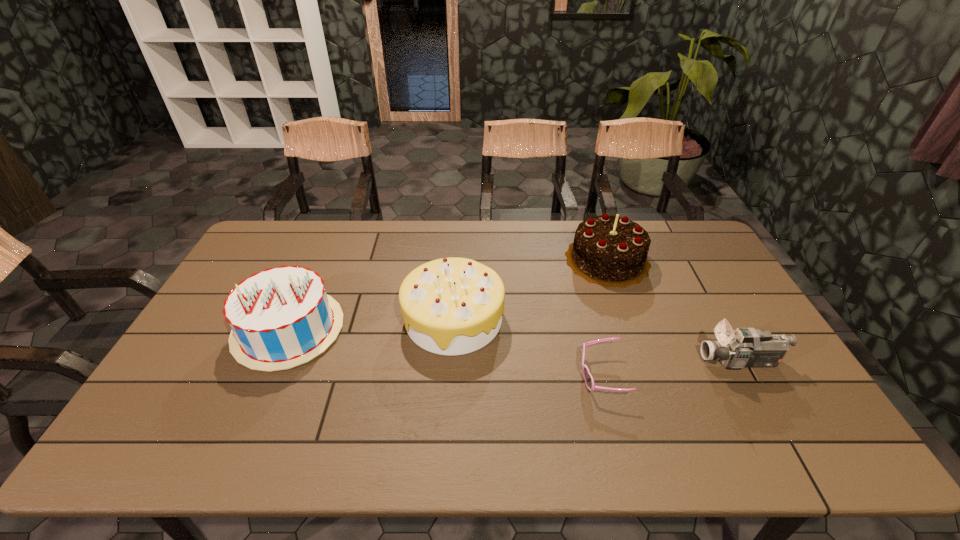
This screenshot has height=540, width=960. In order to click on the rightmost birthday cake in this screenshot , I will do `click(608, 250)`.

Where is `the leftmost object`? This screenshot has height=540, width=960. the leftmost object is located at coordinates (281, 317).

Where is `the second object from left to right`? This screenshot has width=960, height=540. the second object from left to right is located at coordinates (451, 306).

The height and width of the screenshot is (540, 960). In order to click on camcorder in this screenshot , I will do `click(744, 347)`.

Image resolution: width=960 pixels, height=540 pixels. I want to click on the fourth tallest object, so click(744, 347).

Identify the location of the shortest object. (588, 378).

Find the location of a particular element. free spot located 0.250m on the front of the rightmost birthday cake is located at coordinates (637, 348).

Where is `free location located 0.340m on the right of the leftmost birthday cake`? This screenshot has width=960, height=540. free location located 0.340m on the right of the leftmost birthday cake is located at coordinates (460, 329).

Locate an element on the screen. The image size is (960, 540). vacant space situated 0.060m on the left of the second object from left to right is located at coordinates (383, 319).

Where is `vacant space situated 0.220m on the front-facing side of the rightmost object`? This screenshot has width=960, height=540. vacant space situated 0.220m on the front-facing side of the rightmost object is located at coordinates (620, 362).